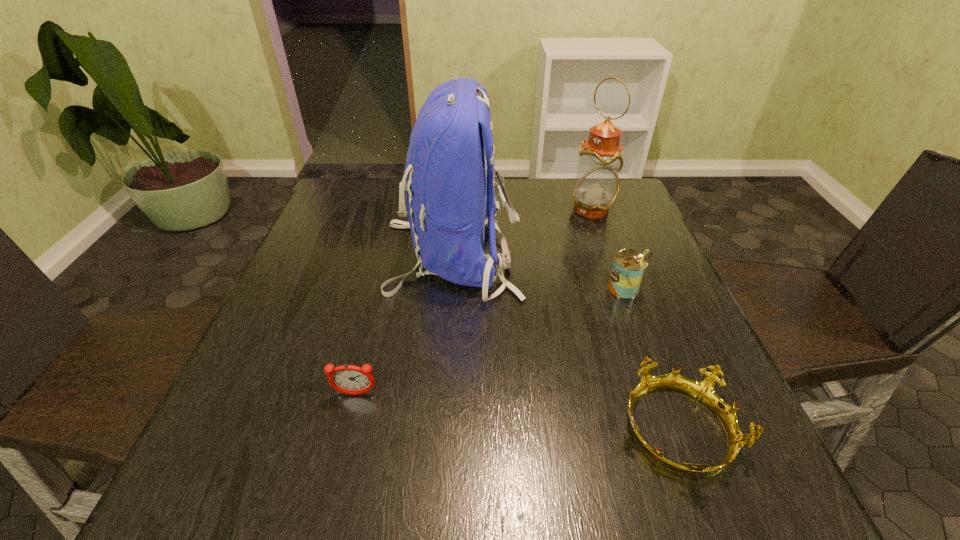
You are a GUI agent. You are given a task and a screenshot of the screen. Output one action in this format:
    pyautogui.click(x=<x>, y=<y>)
    Task: Click on the free region at the left edge
    This screenshot has height=540, width=960.
    Given the screenshot: What is the action you would take?
    pyautogui.click(x=322, y=238)

The image size is (960, 540). In order to click on free point at the right edge in this screenshot , I will do `click(617, 242)`.

I want to click on vacant space at the near left corner of the desktop, so click(252, 461).

Identify the location of free space at the near right corner. (694, 491).

At what (x,y) coordinates should I click in order to perform the action: click on free space that is in between the third shortest object and the alarm clock. Please return your answer as a coordinate pair (x, y). This screenshot has width=960, height=540. Looking at the image, I should click on (491, 342).

You are a GUI agent. You are given a task and a screenshot of the screen. Output one action in this format:
    pyautogui.click(x=<x>, y=<y>)
    Task: Click on the vacant area that lies between the crown and the alarm clock
    
    Given the screenshot: What is the action you would take?
    coord(516,412)

At what (x,y) coordinates should I click in order to perform the action: click on vacant point located between the crown and the oil lamp. Please return your answer as a coordinate pair (x, y). Looking at the image, I should click on (635, 320).

Identify the location of vacant area that lies between the crown and the oil lamp. (635, 320).

I want to click on free space between the backpack and the alarm clock, so click(x=403, y=325).

You are a GUI agent. You are given a task and a screenshot of the screen. Output one action in this format:
    pyautogui.click(x=<x>, y=<y>)
    Task: Click on the vacant space that is in between the backpack and the oil lamp
    Image resolution: width=960 pixels, height=540 pixels.
    Given the screenshot: What is the action you would take?
    click(x=521, y=232)